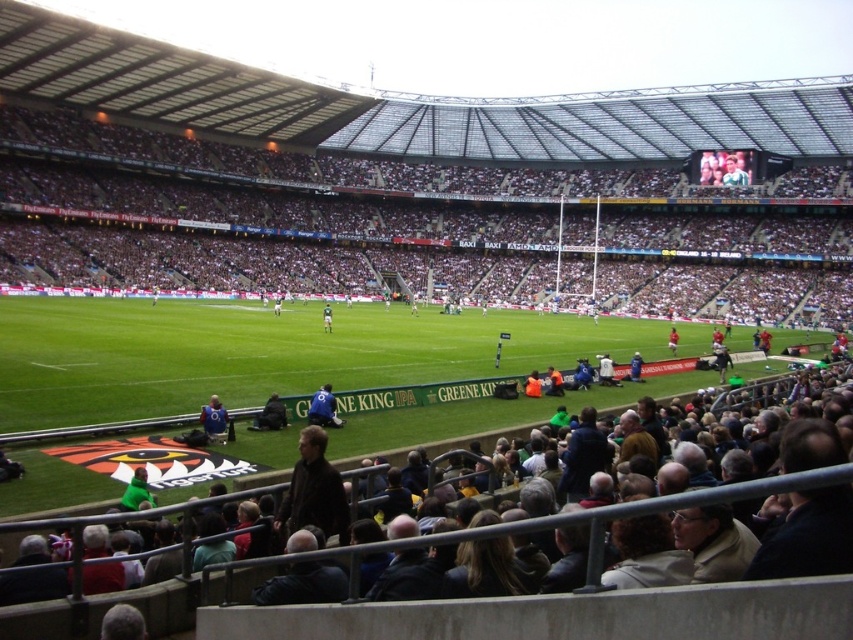
You are at the stadium watching a rugby match and want to locate the blue fabric jacket at lower center. According to the coordinates provided, where exactly is the blue fabric jacket positioned in the image?

The blue fabric jacket at lower center is located at point coordinates of 0.655 on the x axis and 0.253 on the y axis.

You are a photographer trying to capture a photo of the blue fabric jacket at lower center and the red jersey at center. Which object should you zoom in on to ensure both are clearly visible in the frame?

The blue fabric jacket at lower center has a lesser width compared to the red jersey at center. To ensure both are clearly visible, you should zoom in on the red jersey at center since it is larger and will require more focus to capture details without cropping.